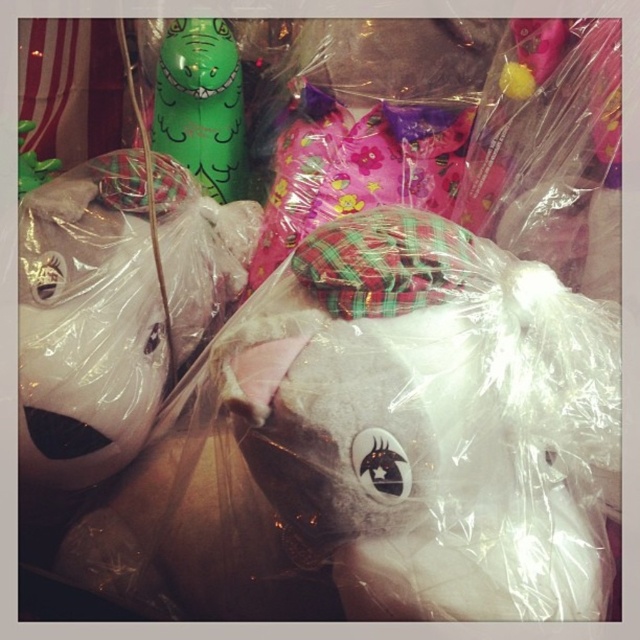
Question: Where is white plush unicorn at lower left located in relation to green rubber toy at upper left in the image?

Choices:
 (A) left
 (B) right

Answer: (A)

Question: Which point is farther to the camera?

Choices:
 (A) tap(211, 35)
 (B) tap(99, 476)

Answer: (A)

Question: Where is white plush unicorn at lower left located in relation to green rubber toy at upper left in the image?

Choices:
 (A) above
 (B) below

Answer: (B)

Question: Which point is closer to the camera taking this photo?

Choices:
 (A) (116, 465)
 (B) (173, 36)

Answer: (A)

Question: Which object appears farthest from the camera in this image?

Choices:
 (A) green rubber toy at upper left
 (B) white plush unicorn at lower left

Answer: (A)

Question: Is white plush unicorn at lower left thinner than green rubber toy at upper left?

Choices:
 (A) yes
 (B) no

Answer: (B)